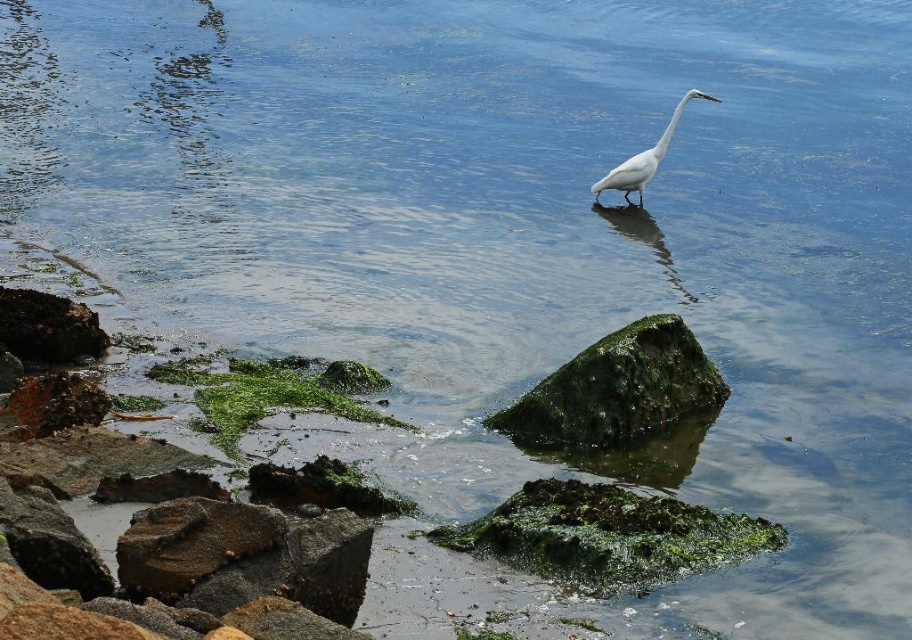
Is green mossy rock at lower center thinner than green mossy rock at center?

No.

Can you confirm if green mossy rock at lower center is positioned to the right of green mossy rock at center?

In fact, green mossy rock at lower center is to the left of green mossy rock at center.

Between point (758, 532) and point (627, 328), which one is positioned behind?

The point (627, 328) is behind.

Locate an element on the screen. The height and width of the screenshot is (640, 912). green mossy rock at lower center is located at coordinates (608, 536).

Measure the distance between green mossy rock at lower center and white smooth bird at center.

They are 6.20 meters apart.

Is green mossy rock at lower center bigger than white smooth bird at center?

No.

Who is more distant from viewer, [672,497] or [716,97]?

The point [716,97] is behind.

You are a GUI agent. You are given a task and a screenshot of the screen. Output one action in this format:
    pyautogui.click(x=<x>, y=<y>)
    Task: Click on the green mossy rock at lower center
    This screenshot has width=912, height=640.
    Given the screenshot: What is the action you would take?
    pyautogui.click(x=608, y=536)

Who is positioned more to the right, green mossy rock at center or green mossy algae at lower left?

green mossy rock at center is more to the right.

Find the location of a particular element. green mossy rock at center is located at coordinates (617, 388).